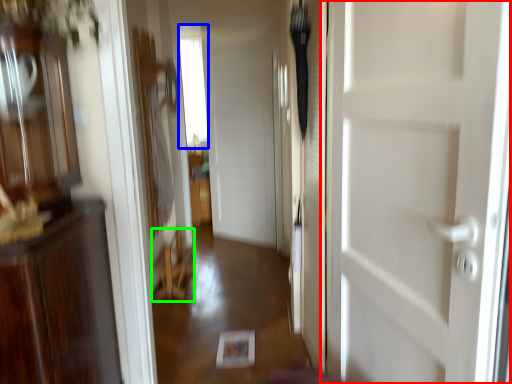
Question: Which is nearer to the door (highlighted by a red box)? window (highlighted by a blue box) or furniture (highlighted by a green box).

Choices:
 (A) window
 (B) furniture

Answer: (B)